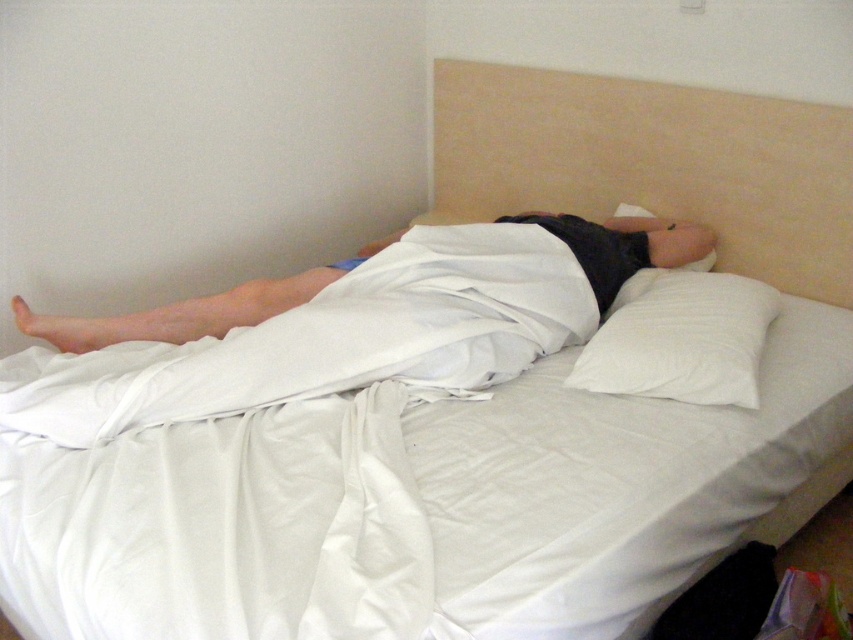
Who is taller, beige fabric headboard at upper center or smooth white towel at lower left?

beige fabric headboard at upper center is taller.

Who is positioned more to the right, beige fabric headboard at upper center or smooth white towel at lower left?

Positioned to the right is smooth white towel at lower left.

Is point (761, 99) farther from viewer compared to point (198, 330)?

Yes, it is.

Where is `beige fabric headboard at upper center`? beige fabric headboard at upper center is located at coordinates (653, 163).

Who is taller, beige fabric headboard at upper center or white soft pillow at upper right?

Standing taller between the two is beige fabric headboard at upper center.

Does point (477, 172) come in front of point (628, 336)?

No, it is behind (628, 336).

What are the coordinates of `beige fabric headboard at upper center` in the screenshot? It's located at (653, 163).

Is white soft pillow at upper right to the right of smooth white towel at lower left from the viewer's perspective?

Correct, you'll find white soft pillow at upper right to the right of smooth white towel at lower left.

Is white soft pillow at upper right above smooth white towel at lower left?

Incorrect, white soft pillow at upper right is not positioned above smooth white towel at lower left.

Which is in front, point (653, 355) or point (15, 312)?

Point (653, 355) is more forward.

Where is `white soft pillow at upper right`? white soft pillow at upper right is located at coordinates (682, 339).